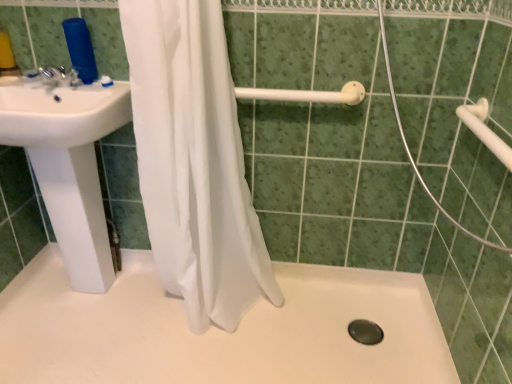
Question: From a real-world perspective, is white glossy sink at left above or below white sheer curtain at center?

Choices:
 (A) below
 (B) above

Answer: (A)

Question: Visually, is white glossy sink at left positioned to the left or to the right of white sheer curtain at center?

Choices:
 (A) left
 (B) right

Answer: (A)

Question: Considering the real-world distances, which object is closest to the silver metallic faucet at upper left?

Choices:
 (A) white plastic shower rod at upper center
 (B) white glossy sink at left
 (C) white sheer curtain at center
 (D) black rubber drain at bottom center
 (E) white matte bath at center

Answer: (B)

Question: Which object is the farthest from the white sheer curtain at center?

Choices:
 (A) silver metallic faucet at upper left
 (B) white glossy sink at left
 (C) white matte bath at center
 (D) black rubber drain at bottom center
 (E) white plastic towel bar at upper right

Answer: (E)